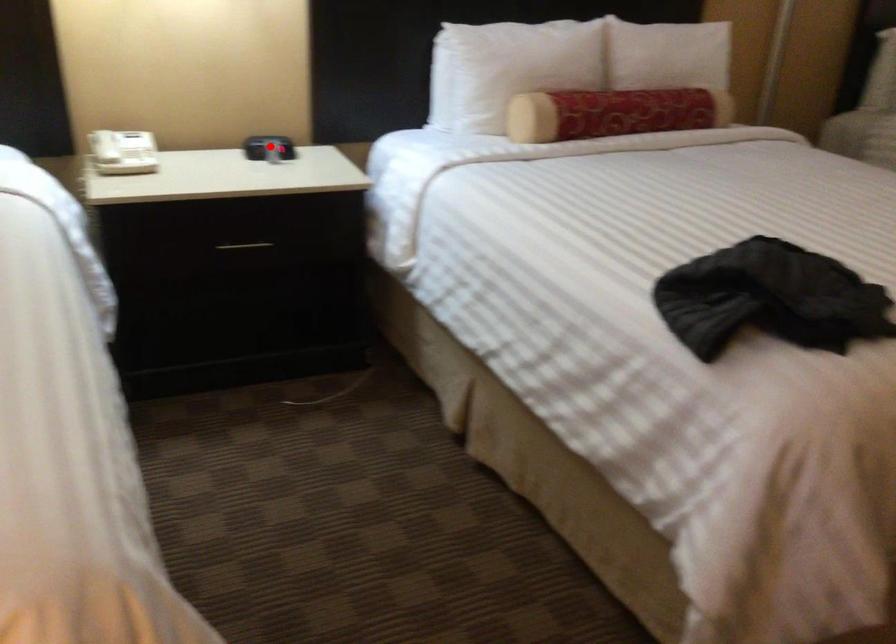
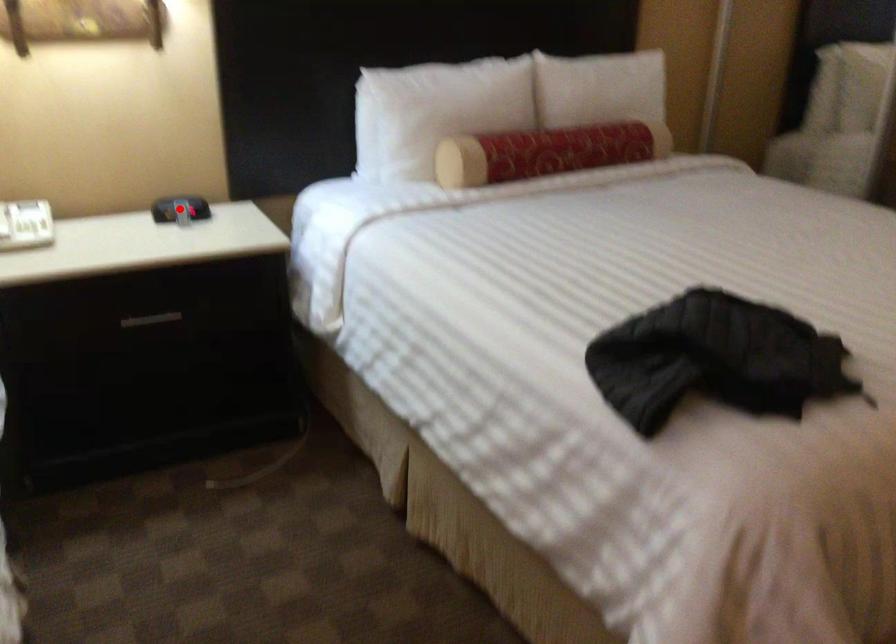
I am providing you with two images of the same scene from different viewpoints. A red point is marked on the first image and another point is marked on the second image. Do the highlighted points in image1 and image2 indicate the same real-world spot?

Yes